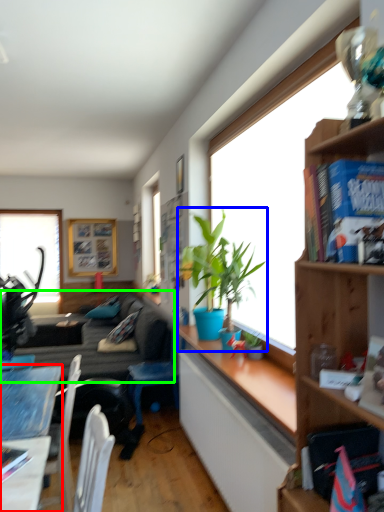
Question: Which object is positioned farthest from desk (highlighted by a red box)? Select from houseplant (highlighted by a blue box) and studio couch (highlighted by a green box).

Choices:
 (A) houseplant
 (B) studio couch

Answer: (B)